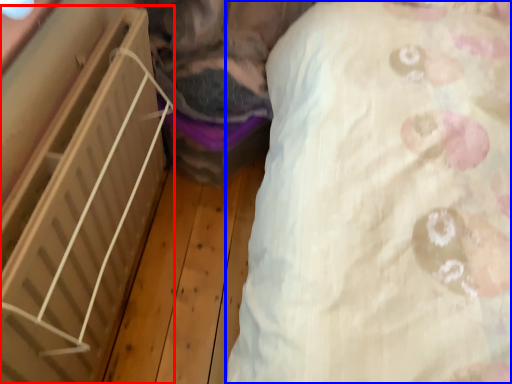
Question: Which of the following is the closest to the observer, furniture (highlighted by a red box) or sheet (highlighted by a blue box)?

Choices:
 (A) furniture
 (B) sheet

Answer: (B)